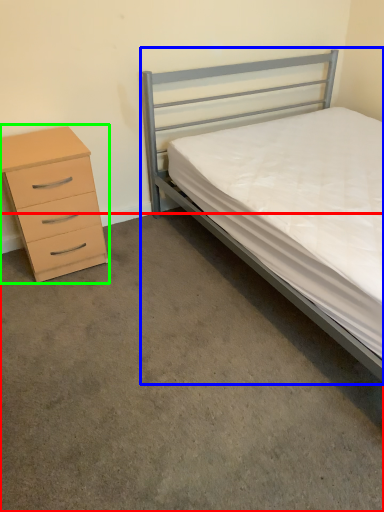
Question: Which object is positioned closest to concrete (highlighted by a red box)? Select from bed (highlighted by a blue box) and chest of drawers (highlighted by a green box).

Choices:
 (A) bed
 (B) chest of drawers

Answer: (B)